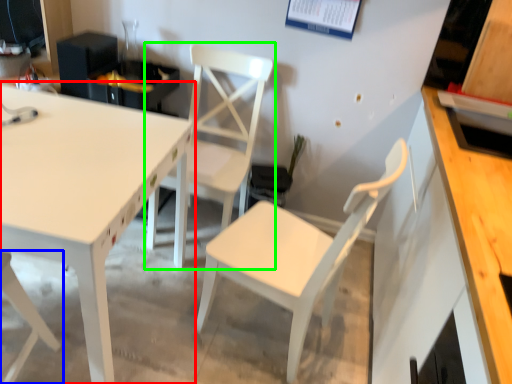
Question: Estimate the real-world distances between objects in this image. Which object is closer to table (highlighted by a red box), chair (highlighted by a blue box) or chair (highlighted by a green box)?

Choices:
 (A) chair
 (B) chair

Answer: (A)